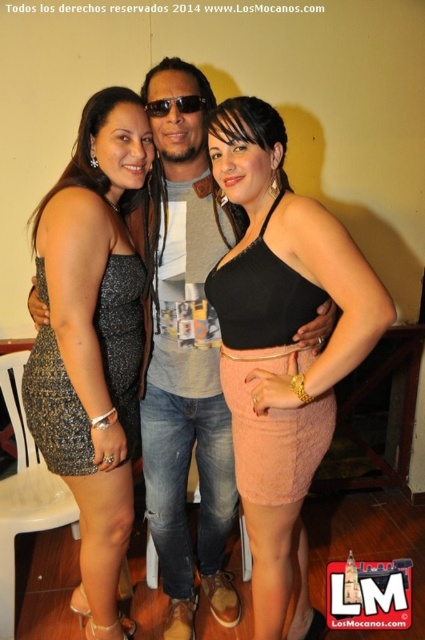
Can you confirm if sparkly silver dress at left is positioned to the right of black plastic sunglasses at center?

Incorrect, sparkly silver dress at left is not on the right side of black plastic sunglasses at center.

Does point (61, 208) come behind point (197, 97)?

No, (61, 208) is closer to viewer.

Which is behind, point (76, 177) or point (158, 104)?

The point (76, 177) is more distant.

Identify the location of sparkly silver dress at left. The image size is (425, 640). (93, 337).

Is sparkly silver dress at left closer to the viewer compared to gray cotton t-shirt at center?

That is True.

Is sparkly silver dress at left thinner than gray cotton t-shirt at center?

In fact, sparkly silver dress at left might be wider than gray cotton t-shirt at center.

What do you see at coordinates (93, 337) in the screenshot? The width and height of the screenshot is (425, 640). I see `sparkly silver dress at left` at bounding box center [93, 337].

Where is `sparkly silver dress at left`? Image resolution: width=425 pixels, height=640 pixels. sparkly silver dress at left is located at coordinates (93, 337).

Based on the photo, is gray cotton t-shirt at center closer to the viewer compared to black plastic sunglasses at center?

No, gray cotton t-shirt at center is further to the viewer.

Does gray cotton t-shirt at center have a greater width compared to black plastic sunglasses at center?

Yes.

Where is `gray cotton t-shirt at center`? The image size is (425, 640). gray cotton t-shirt at center is located at coordinates (187, 387).